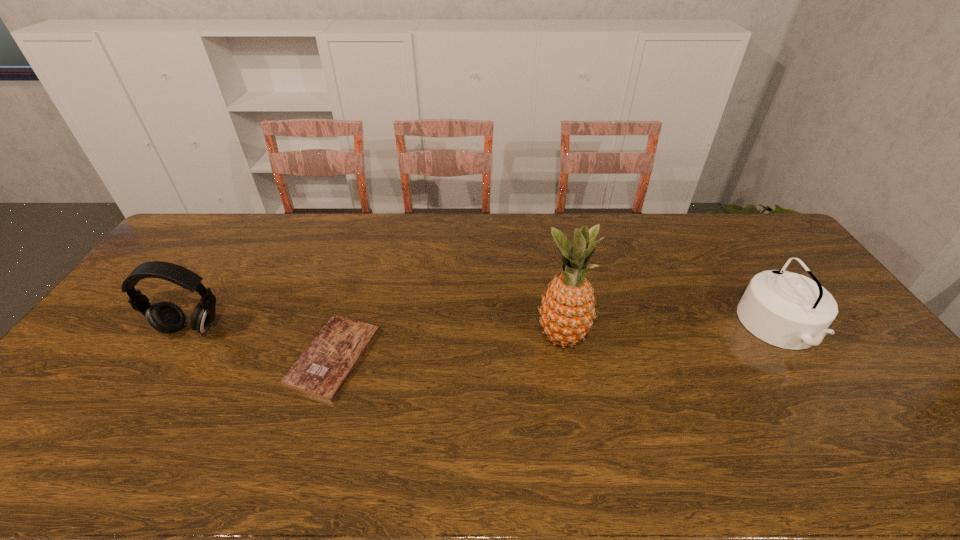
Find the location of `pineapple`. pineapple is located at coordinates (567, 312).

Locate an element on the screen. the tallest object is located at coordinates (567, 312).

Locate an element on the screen. The image size is (960, 540). the second tallest object is located at coordinates (166, 317).

I want to click on the leftmost object, so click(166, 317).

The height and width of the screenshot is (540, 960). What are the coordinates of `the rightmost object` in the screenshot? It's located at (788, 310).

You are a GUI agent. You are given a task and a screenshot of the screen. Output one action in this format:
    pyautogui.click(x=<x>, y=<y>)
    Task: Click on the second shortest object
    The width and height of the screenshot is (960, 540).
    Given the screenshot: What is the action you would take?
    pyautogui.click(x=788, y=310)

Find the location of a particular element. the shortest object is located at coordinates (322, 370).

The image size is (960, 540). Identify the location of Bible. pyautogui.click(x=322, y=370).

Find the location of a particular element. The height and width of the screenshot is (540, 960). free space located on the right of the pineapple is located at coordinates (642, 337).

The image size is (960, 540). I want to click on free point located 0.330m on the ear cups of the third shortest object, so click(x=111, y=453).